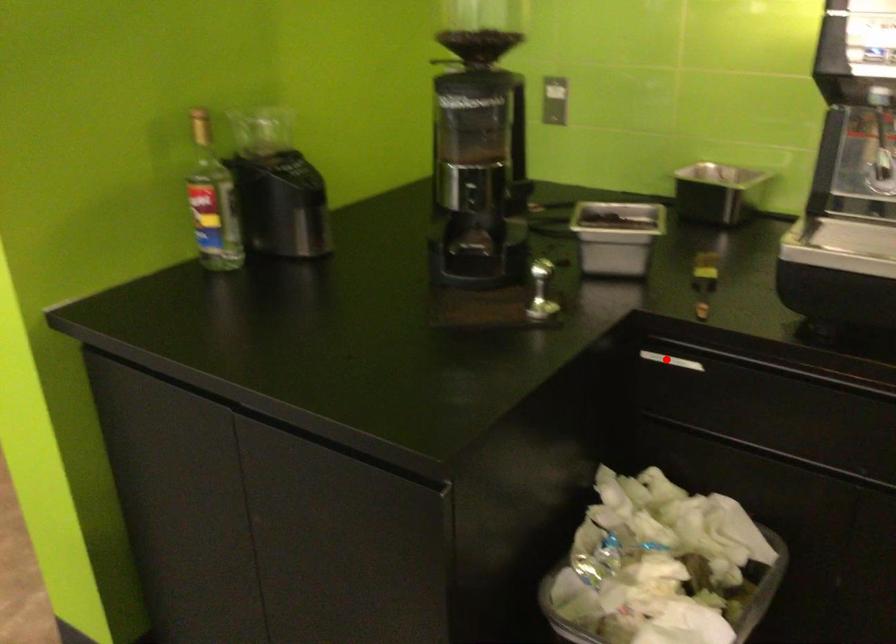
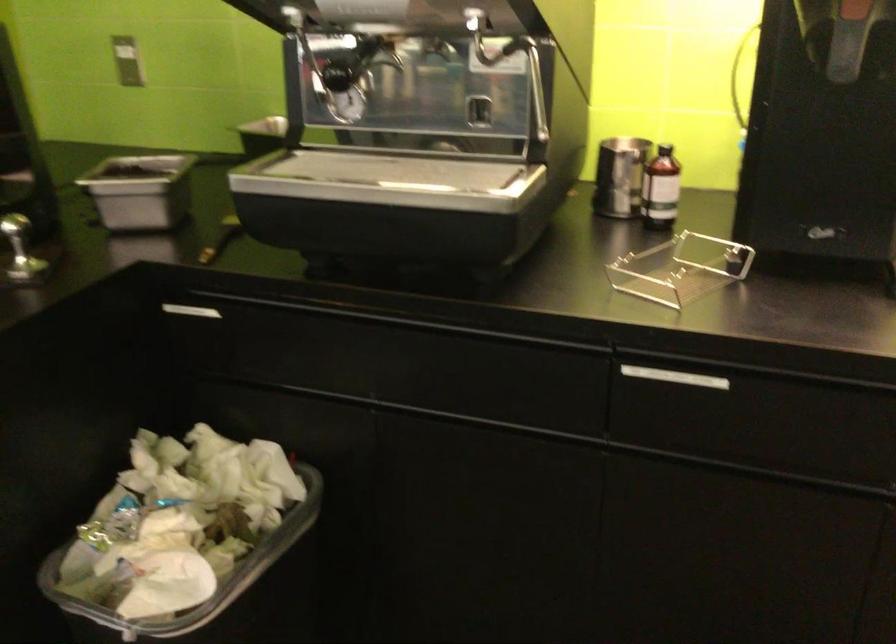
Question: I am providing you with two images of the same scene from different viewpoints. A red point is marked on the first image. Can you still see the location of the red point in image 2?

Choices:
 (A) Yes
 (B) No

Answer: (A)